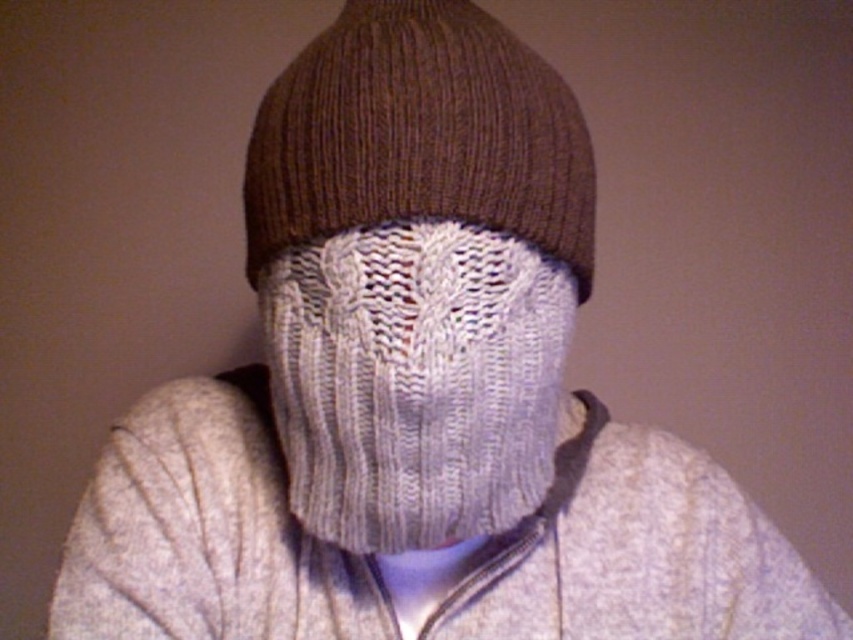
You are a fashion designer trying to create a winter outfit. You have a white knitted scarf at center and a brown knitted hat at upper center. Which item is located to the left of the other?

The white knitted scarf at center is positioned on the left side of brown knitted hat at upper center.

You are a fashion designer trying to create a winter outfit. You have a white knitted scarf at center and a brown knitted hat at upper center. Which item should you place higher on the model to ensure proper layering?

The brown knitted hat at upper center should be placed higher since the white knitted scarf at center is positioned under it, indicating the hat should be above the scarf in layering.

You are a fashion designer analyzing the image of a person wearing a brown knit beanie and a gray knitted balaclava. You notice a point at coordinates (415, 380). What object is located at this point?

The point at coordinates (415, 380) corresponds to the white knitted scarf at center.